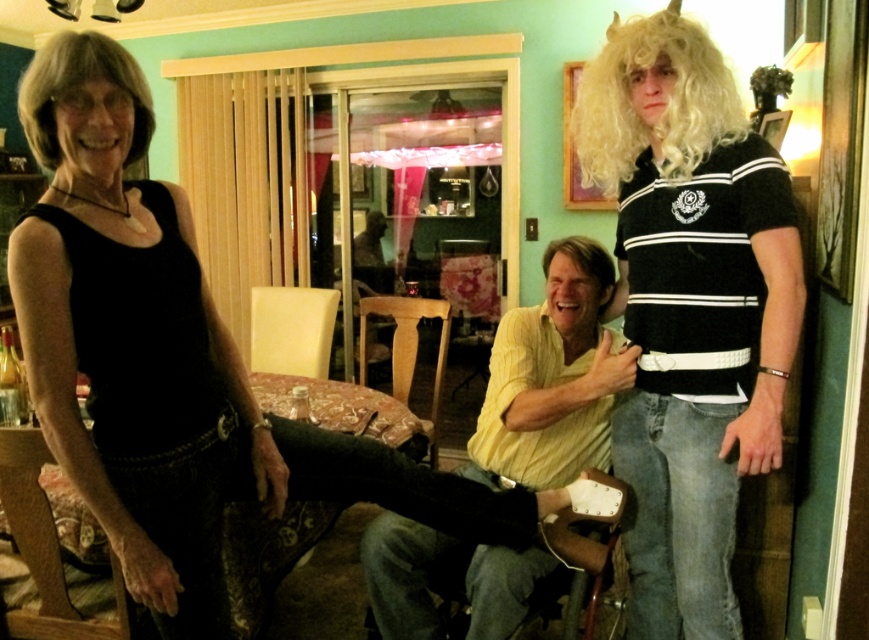
Question: Which of the following is the farthest from the observer?

Choices:
 (A) (133, 67)
 (B) (167, 330)

Answer: (B)

Question: Which point is closer to the camera?

Choices:
 (A) (20, 467)
 (B) (377, 296)
 (C) (38, 131)

Answer: (C)

Question: Which is nearer to the brown wooden chair at lower left?

Choices:
 (A) wooden chair at center
 (B) leather-like cream chair at center

Answer: (A)

Question: Is black matte tank top at left wider than blonde synthetic wig at center?

Choices:
 (A) no
 (B) yes

Answer: (B)

Question: Is yellow striped shirt at center below blonde synthetic wig at center?

Choices:
 (A) no
 (B) yes

Answer: (B)

Question: Does leather-like cream chair at center appear on the left side of blonde synthetic wig at center?

Choices:
 (A) yes
 (B) no

Answer: (A)